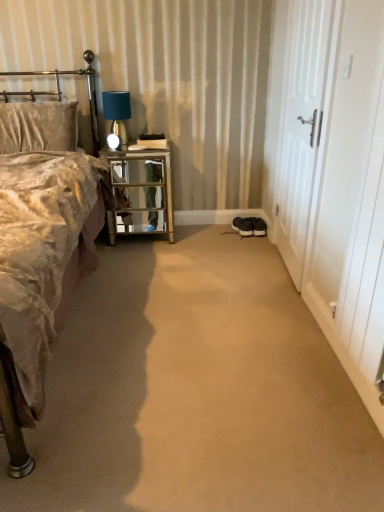
The width and height of the screenshot is (384, 512). In order to click on free point to the left of black suede sneakers at lower center in this screenshot , I will do `click(218, 229)`.